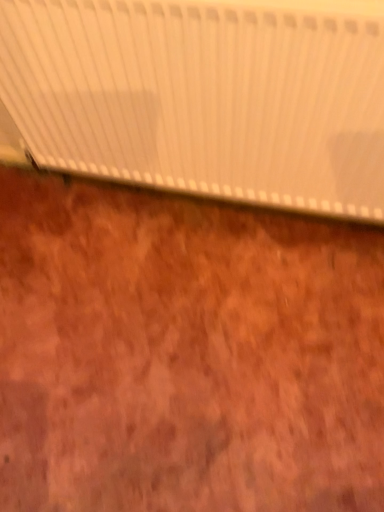
Image resolution: width=384 pixels, height=512 pixels. Describe the element at coordinates (185, 353) in the screenshot. I see `brown wood plywood at center` at that location.

Find the location of a particular element. The height and width of the screenshot is (512, 384). brown wood plywood at center is located at coordinates (185, 353).

The width and height of the screenshot is (384, 512). What do you see at coordinates (202, 97) in the screenshot? I see `white matte radiator at upper center` at bounding box center [202, 97].

This screenshot has width=384, height=512. What are the coordinates of `white matte radiator at upper center` in the screenshot? It's located at (202, 97).

Identify the location of brown wood plywood at center. (185, 353).

Which is more to the left, brown wood plywood at center or white matte radiator at upper center?

Positioned to the left is brown wood plywood at center.

Does brown wood plywood at center come in front of white matte radiator at upper center?

No, it is not.

Considering the points (293, 444) and (156, 155), which point is behind, point (293, 444) or point (156, 155)?

The point (156, 155) is farther from the camera.

From the image's perspective, between brown wood plywood at center and white matte radiator at upper center, which one is located above?

white matte radiator at upper center.

From a real-world perspective, who is located lower, brown wood plywood at center or white matte radiator at upper center?

brown wood plywood at center, from a real-world perspective.

Can you confirm if brown wood plywood at center is thinner than white matte radiator at upper center?

No, brown wood plywood at center is not thinner than white matte radiator at upper center.

Can you confirm if brown wood plywood at center is taller than white matte radiator at upper center?

No.

Considering the sizes of objects brown wood plywood at center and white matte radiator at upper center in the image provided, who is smaller, brown wood plywood at center or white matte radiator at upper center?

With smaller size is brown wood plywood at center.

Do you think brown wood plywood at center is within white matte radiator at upper center, or outside of it?

brown wood plywood at center is outside white matte radiator at upper center.

Is brown wood plywood at center not near white matte radiator at upper center?

No.

Is brown wood plywood at center turned away from white matte radiator at upper center?

No, brown wood plywood at center's orientation is not away from white matte radiator at upper center.

Locate an element on the screen. curtain on the right side of brown wood plywood at center is located at coordinates (202, 97).

Is white matte radiator at upper center at the right side of brown wood plywood at center?

Yes.

Considering the relative positions of white matte radiator at upper center and brown wood plywood at center in the image provided, is white matte radiator at upper center behind brown wood plywood at center?

No, the depth of white matte radiator at upper center is less than that of brown wood plywood at center.

Is point (65, 59) more distant than point (309, 486)?

No, it is in front of (309, 486).

Consider the image. From the image's perspective, is white matte radiator at upper center located above brown wood plywood at center?

Yes.

Based on the photo, from a real-world perspective, is white matte radiator at upper center below brown wood plywood at center?

No.

Does white matte radiator at upper center have a greater width compared to brown wood plywood at center?

No, white matte radiator at upper center is not wider than brown wood plywood at center.

Considering the sizes of objects white matte radiator at upper center and brown wood plywood at center in the image provided, who is shorter, white matte radiator at upper center or brown wood plywood at center?

Standing shorter between the two is brown wood plywood at center.

Does white matte radiator at upper center have a larger size compared to brown wood plywood at center?

Indeed, white matte radiator at upper center has a larger size compared to brown wood plywood at center.

Does white matte radiator at upper center contain brown wood plywood at center?

No, brown wood plywood at center is located outside of white matte radiator at upper center.

Is white matte radiator at upper center directly adjacent to brown wood plywood at center?

They are not placed beside each other.

Is brown wood plywood at center at the back of white matte radiator at upper center?

No, white matte radiator at upper center is not facing the opposite direction of brown wood plywood at center.

How far apart are white matte radiator at upper center and brown wood plywood at center?

white matte radiator at upper center is 17.34 inches from brown wood plywood at center.

Locate an element on the screen. The width and height of the screenshot is (384, 512). plywood below the white matte radiator at upper center (from the image's perspective) is located at coordinates (185, 353).

Identify the location of curtain above the brown wood plywood at center (from a real-world perspective). Image resolution: width=384 pixels, height=512 pixels. (202, 97).

Locate an element on the screen. Image resolution: width=384 pixels, height=512 pixels. plywood that is on the left side of white matte radiator at upper center is located at coordinates (185, 353).